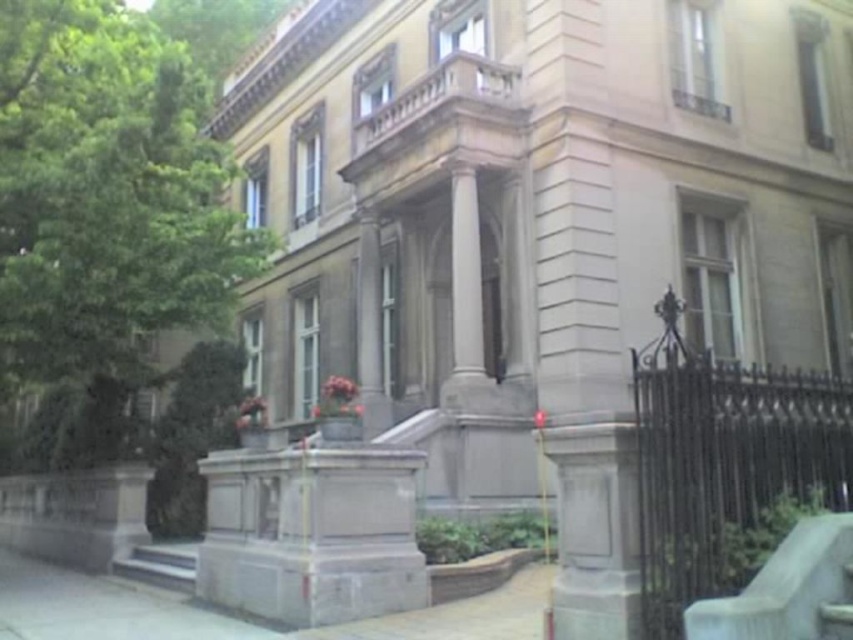
Is white marble column at center smaller than green leafy tree at upper left?

Indeed, white marble column at center has a smaller size compared to green leafy tree at upper left.

Does point (466, 269) come closer to viewer compared to point (165, 10)?

Yes, it is in front of point (165, 10).

This screenshot has height=640, width=853. Find the location of `white marble column at center`. white marble column at center is located at coordinates (466, 300).

Is green leafy tree at upper left above smooth concrete stairs at lower left?

Indeed, green leafy tree at upper left is positioned over smooth concrete stairs at lower left.

Between green leafy tree at upper left and smooth concrete stairs at lower left, which one has more height?

Standing taller between the two is green leafy tree at upper left.

Between point (265, 33) and point (155, 545), which one is positioned in front?

Point (155, 545) is in front.

This screenshot has width=853, height=640. I want to click on green leafy tree at upper left, so click(x=223, y=29).

Is point (85, 296) farther from camera compared to point (126, 563)?

No, (85, 296) is in front of (126, 563).

Which is above, green leafy tree at left or smooth concrete stairs at lower left?

green leafy tree at left

Does point (39, 124) come farther from viewer compared to point (178, 580)?

Yes.

You are a GUI agent. You are given a task and a screenshot of the screen. Output one action in this format:
    pyautogui.click(x=<x>, y=<y>)
    Task: Click on the green leafy tree at left
    This screenshot has height=640, width=853.
    Given the screenshot: What is the action you would take?
    pyautogui.click(x=112, y=180)